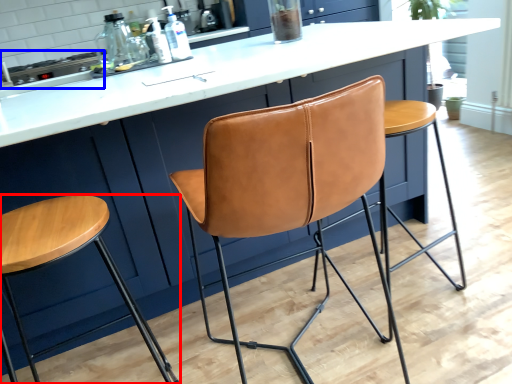
Question: Which point is further to the camera, stool (highlighted by a red box) or appliance (highlighted by a blue box)?

Choices:
 (A) stool
 (B) appliance

Answer: (B)